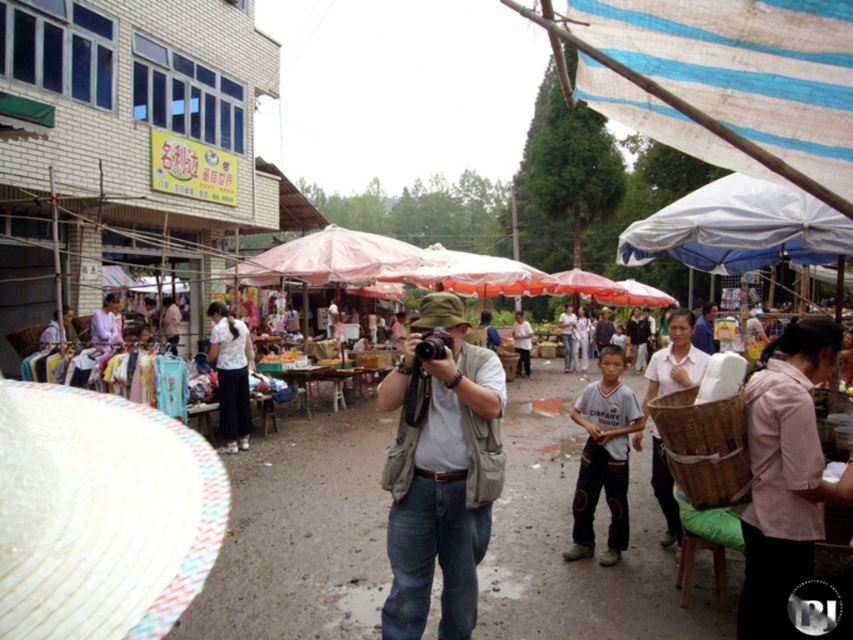
You are a GUI agent. You are given a task and a screenshot of the screen. Output one action in this format:
    pyautogui.click(x=<x>, y=<y>)
    Task: Click on the khaki fabric vest at center
    
    Given the screenshot: What is the action you would take?
    pyautogui.click(x=437, y=474)

Is point (439, 371) positioned after point (520, 356)?

No.

You are a GUI agent. You are given a task and a screenshot of the screen. Output one action in this format:
    pyautogui.click(x=<x>, y=<y>)
    Task: Click on the khaki fabric vest at center
    Image resolution: width=853 pixels, height=640 pixels.
    Given the screenshot: What is the action you would take?
    pyautogui.click(x=437, y=474)

Who is shorter, khaki fabric vest at center or woven bamboo basket at lower right?

woven bamboo basket at lower right is shorter.

The image size is (853, 640). Identify the location of khaki fabric vest at center. (437, 474).

Can you confirm if gray cotton shirt at center is positioned below light brown cotton shirt at center?

Indeed, gray cotton shirt at center is positioned under light brown cotton shirt at center.

Consider the image. Which of these two, gray cotton shirt at center or light brown cotton shirt at center, stands shorter?

gray cotton shirt at center

This screenshot has height=640, width=853. What do you see at coordinates (602, 458) in the screenshot?
I see `gray cotton shirt at center` at bounding box center [602, 458].

In order to click on gray cotton shirt at center in this screenshot , I will do `click(602, 458)`.